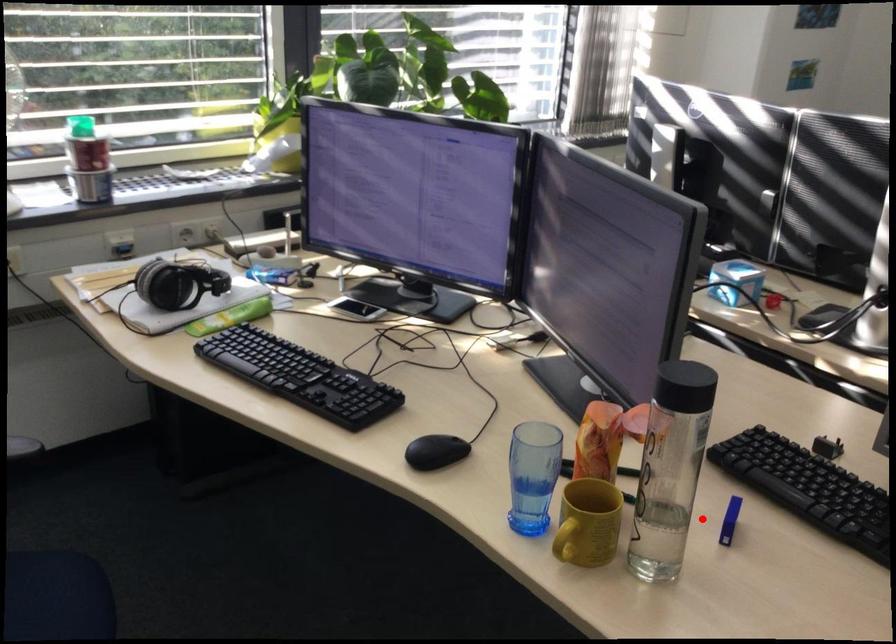
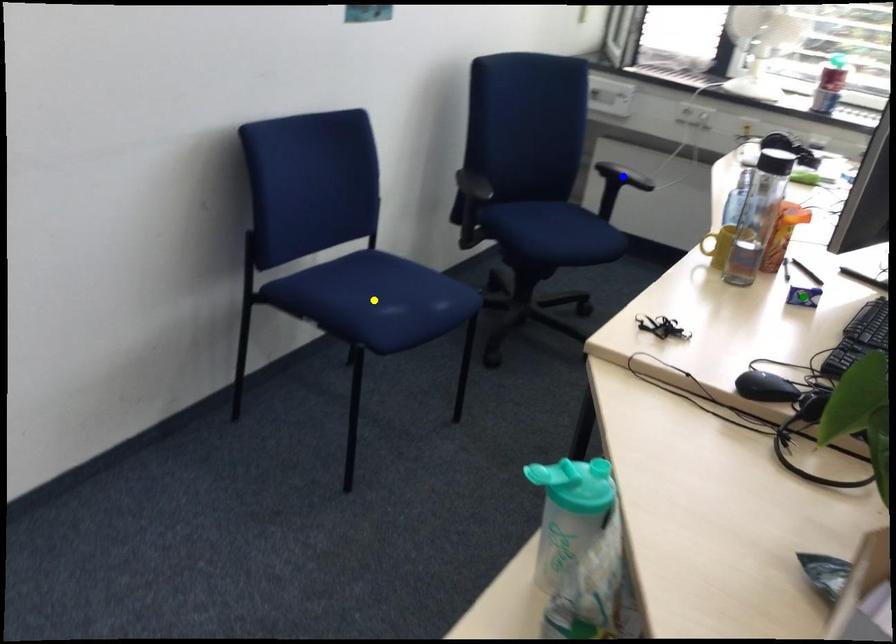
Question: I am providing you with two images of the same scene from different viewpoints. A red point is marked on the first image. You are given multiple points on the second image. Which mark in image 2 goes with the point in image 1?

Choices:
 (A) yellow point
 (B) blue point
 (C) green point

Answer: (C)